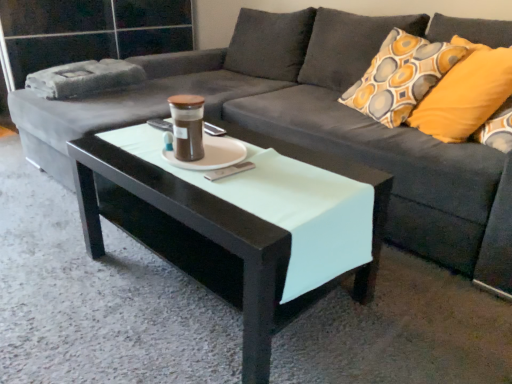
Question: Is black glossy coffee table at center shorter than brown glass jar at center?

Choices:
 (A) no
 (B) yes

Answer: (A)

Question: Is black glossy coffee table at center far from brown glass jar at center?

Choices:
 (A) no
 (B) yes

Answer: (A)

Question: Is black glossy coffee table at center thinner than brown glass jar at center?

Choices:
 (A) no
 (B) yes

Answer: (A)

Question: Can you confirm if black glossy coffee table at center is bigger than brown glass jar at center?

Choices:
 (A) yes
 (B) no

Answer: (A)

Question: From the image's perspective, is black glossy coffee table at center under brown glass jar at center?

Choices:
 (A) yes
 (B) no

Answer: (A)

Question: Does black glossy coffee table at center have a greater width compared to brown glass jar at center?

Choices:
 (A) no
 (B) yes

Answer: (B)

Question: Does yellow fabric pillow at right touch white matte saucer at center?

Choices:
 (A) yes
 (B) no

Answer: (B)

Question: Is yellow fabric pillow at right closer to the viewer compared to white matte saucer at center?

Choices:
 (A) no
 (B) yes

Answer: (A)

Question: Does yellow fabric pillow at right have a larger size compared to white matte saucer at center?

Choices:
 (A) no
 (B) yes

Answer: (B)

Question: Considering the relative sizes of yellow fabric pillow at right and white matte saucer at center in the image provided, is yellow fabric pillow at right taller than white matte saucer at center?

Choices:
 (A) no
 (B) yes

Answer: (B)

Question: Is yellow fabric pillow at right positioned with its back to white matte saucer at center?

Choices:
 (A) no
 (B) yes

Answer: (A)

Question: Is yellow fabric pillow at right further to camera compared to white matte saucer at center?

Choices:
 (A) yes
 (B) no

Answer: (A)

Question: From a real-world perspective, is black glossy coffee table at center physically below transparent glass door at upper left?

Choices:
 (A) yes
 (B) no

Answer: (A)